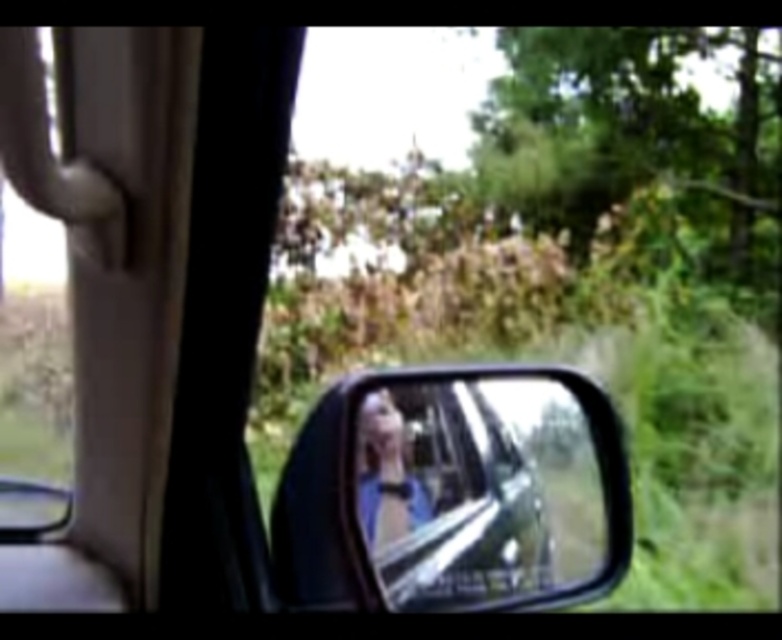
Can you confirm if glossy metallic mirror at center is positioned below blue fabric person at center?

Yes.

Can you confirm if glossy metallic mirror at center is shorter than blue fabric person at center?

No, glossy metallic mirror at center is not shorter than blue fabric person at center.

Who is more forward, (397, 420) or (388, 460)?

Point (388, 460)

Identify the location of glossy metallic mirror at center. (476, 490).